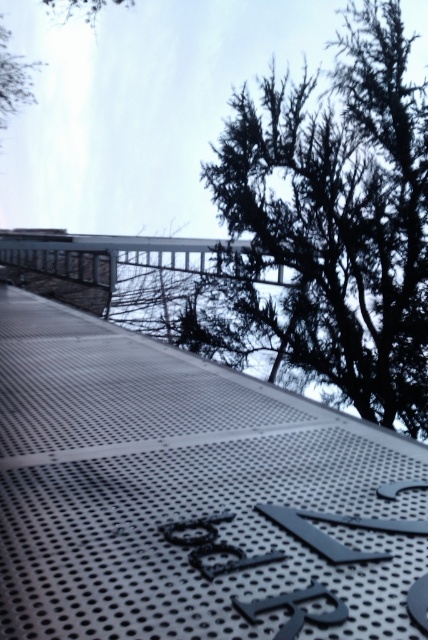
Identify the location of metallic perforated ramp at center. This screenshot has height=640, width=428. (187, 493).

Which of these two, metallic perforated ramp at center or dark green textured tree at upper right, stands shorter?

Standing shorter between the two is metallic perforated ramp at center.

Between point (177, 493) and point (318, 138), which one is positioned in front?

Point (177, 493)

The width and height of the screenshot is (428, 640). I want to click on metallic perforated ramp at center, so click(x=187, y=493).